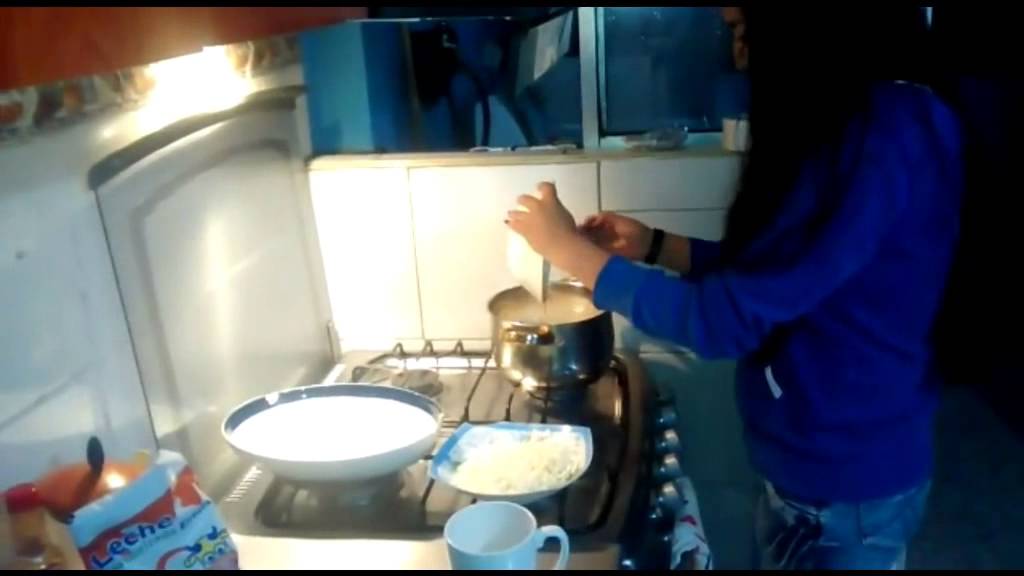
At what (x,y) coordinates should I click in order to perform the action: click on wall. Please return your answer as a coordinate pair (x, y). This screenshot has width=1024, height=576. Looking at the image, I should click on (475, 233).